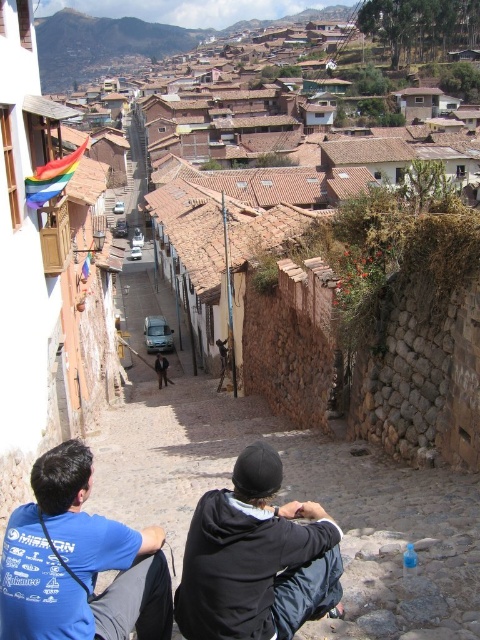
Question: Which of these objects is positioned farthest from the blue cotton t-shirt at lower left?

Choices:
 (A) black fleece jacket at center
 (B) blue cotton shirt at lower left

Answer: (A)

Question: Does blue cotton t-shirt at lower left appear over black fleece jacket at center?

Choices:
 (A) yes
 (B) no

Answer: (B)

Question: Is blue cotton shirt at lower left above black fleece jacket at center?

Choices:
 (A) yes
 (B) no

Answer: (B)

Question: In this image, where is blue cotton t-shirt at lower left located relative to blue cotton shirt at lower left?

Choices:
 (A) below
 (B) above

Answer: (B)

Question: Which point appears closest to the camera in this image?

Choices:
 (A) (267, 452)
 (B) (10, 554)
 (C) (252, 580)

Answer: (B)

Question: Which of the following is the farthest from the observer?

Choices:
 (A) (147, 556)
 (B) (245, 492)
 (C) (272, 589)

Answer: (B)